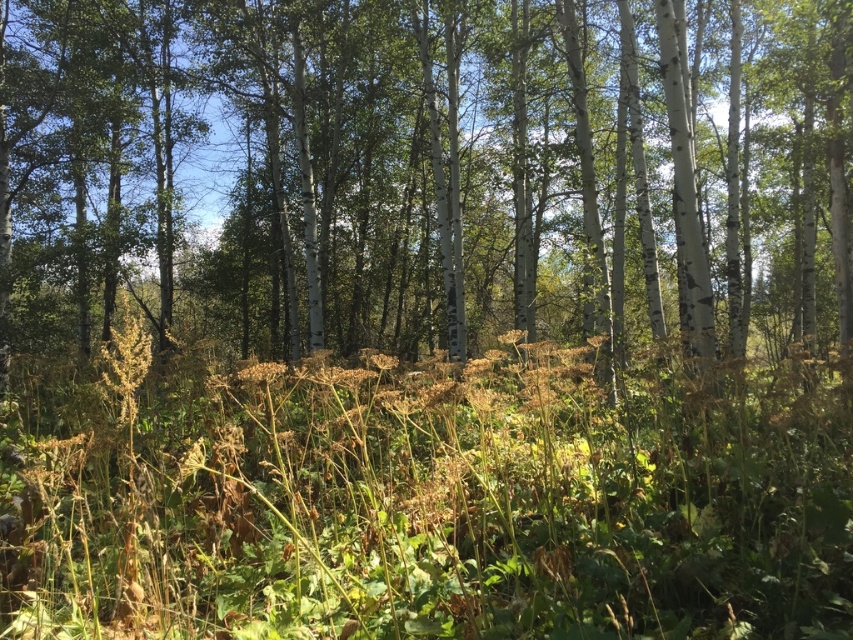
You are standing in the forest scene and want to find the white smooth tree at center. According to the coordinates provided, where should you look relative to your position?

The white smooth tree at center is located at coordinates point (434, 172), which means it is positioned slightly to the left and lower center of the scene from your viewpoint.

From the picture: You are standing in the forest scene described. There is a point marked at coordinates (434, 172). What object does this point indicate?

The point at coordinates (434, 172) marks the white smooth tree at center.

You are an environmental scientist assessing the forest health. You notice the white smooth tree at center and the brown dry grass at center. Which one has a greater width according to your measurements?

The white smooth tree at center has a greater width than the brown dry grass at center.